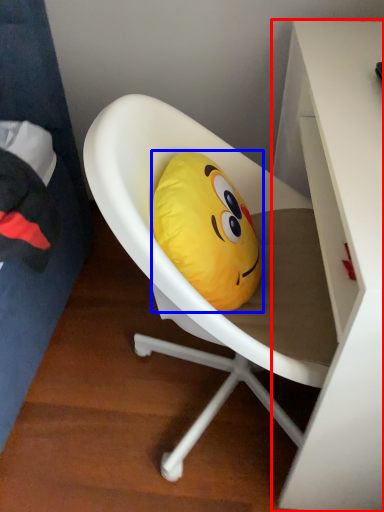
Question: Which object appears farthest to the camera in this image, desk (highlighted by a red box) or pillow (highlighted by a blue box)?

Choices:
 (A) desk
 (B) pillow

Answer: (B)